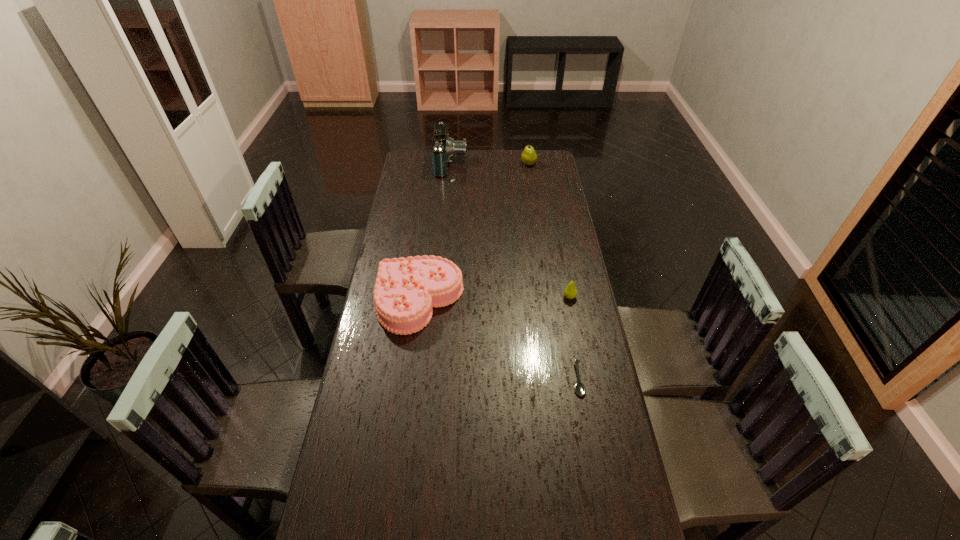
Locate an element on the screen. vacant space at the far edge of the desktop is located at coordinates tap(503, 166).

In the image, there is a desktop. Where is `vacant space at the left edge`? This screenshot has height=540, width=960. vacant space at the left edge is located at coordinates (372, 299).

Identify the location of vacant space at the right edge. (558, 175).

I want to click on vacant space at the far left corner of the desktop, so click(415, 157).

Identify the location of empty space that is in between the cake and the nearest object. (499, 340).

Locate an element on the screen. Image resolution: width=960 pixels, height=540 pixels. free spot between the right pear and the shortest object is located at coordinates click(x=574, y=338).

At what (x,y) coordinates should I click in order to perform the action: click on free space between the camcorder and the second tallest object. Please return your answer as a coordinate pair (x, y). Image resolution: width=960 pixels, height=540 pixels. Looking at the image, I should click on (490, 164).

Where is `vacant area between the cake and the right pear`? The width and height of the screenshot is (960, 540). vacant area between the cake and the right pear is located at coordinates (494, 299).

Locate an element on the screen. empty space between the cake and the left pear is located at coordinates (474, 232).

Image resolution: width=960 pixels, height=540 pixels. I want to click on free space between the nearer pear and the second tallest object, so click(549, 231).